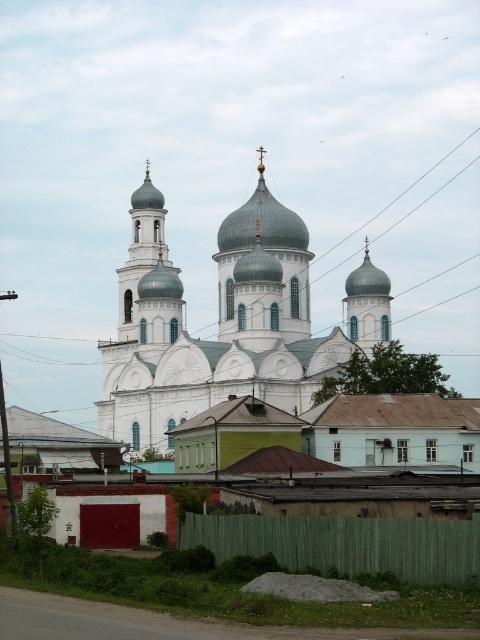
Question: Which point is closer to the camera?

Choices:
 (A) (364, 301)
 (B) (243, 289)

Answer: (B)

Question: Does white stone church at center appear over white stone dome at center?

Choices:
 (A) yes
 (B) no

Answer: (B)

Question: Does white stone dome at center appear on the left side of smooth white dome at center?

Choices:
 (A) yes
 (B) no

Answer: (B)

Question: Which point is closer to the camera taking this photo?

Choices:
 (A) (159, 221)
 (B) (359, 294)

Answer: (B)

Question: Among these objects, which one is nearest to the camera?

Choices:
 (A) smooth white dome at center
 (B) white stone dome at center
 (C) white stone church at center

Answer: (C)

Question: Can you confirm if white stone church at center is thinner than white stone dome at center?

Choices:
 (A) no
 (B) yes

Answer: (A)